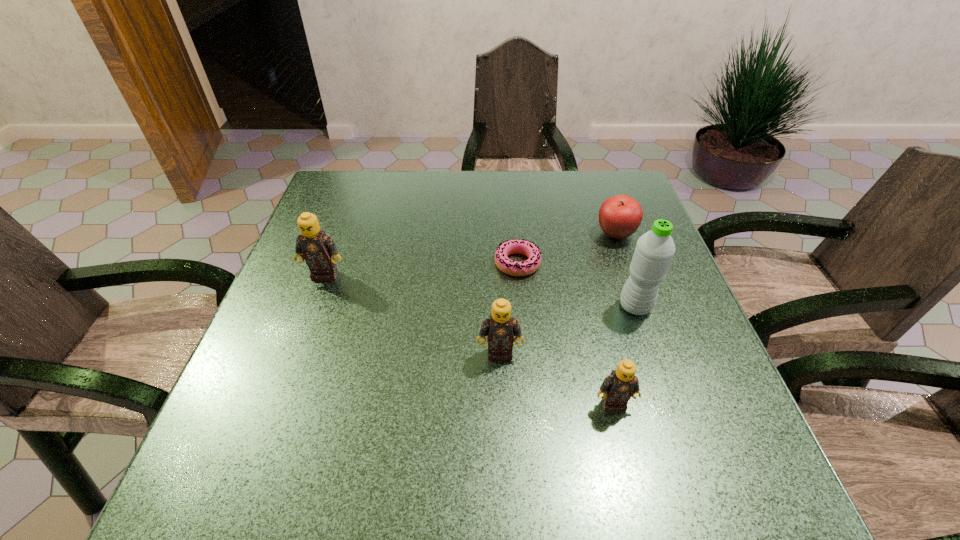
Identify the location of free space between the fourth farthest object and the leftmost Lego. (480, 291).

The height and width of the screenshot is (540, 960). Identify the location of free spot between the doughnut and the leftmost object. (421, 269).

The height and width of the screenshot is (540, 960). Find the location of `vacant area between the farthest object and the third nearest object`. vacant area between the farthest object and the third nearest object is located at coordinates (625, 270).

Where is `vacant area between the leftmost Lego and the apple`? vacant area between the leftmost Lego and the apple is located at coordinates pyautogui.click(x=470, y=254).

The width and height of the screenshot is (960, 540). In order to click on vacant space in between the apple and the shortest object in this screenshot , I will do `click(566, 249)`.

Identify the location of object identified as the second closest to the fourth farthest object. (x=620, y=216).

Identify which object is the second closest to the farthest Lego. Please provide its 2D coordinates. Your answer should be formatted as a tuple, i.e. [(x, y)], where the tuple contains the x and y coordinates of a point satisfying the conditions above.

[(500, 328)]

Identify the location of the closest Lego to the shortest object. (500, 328).

Locate an element on the screen. Image resolution: width=960 pixels, height=540 pixels. Lego that is the closest to the doughnut is located at coordinates (500, 328).

You are a GUI agent. You are given a task and a screenshot of the screen. Output one action in this format:
    pyautogui.click(x=<x>, y=<y>)
    Task: Click on the free space in the image that satisfies the following two spatial constraints: 1. in front of the tallest object; 2. on the right side of the leftmost object
    
    Given the screenshot: What is the action you would take?
    pyautogui.click(x=313, y=307)